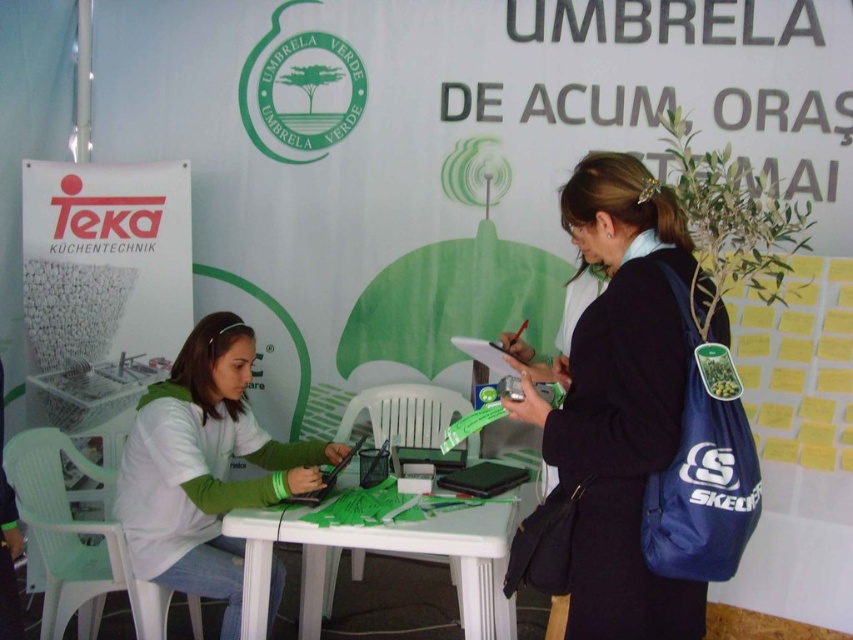
Question: Estimate the real-world distances between objects in this image. Which object is closer to the matte black laptop at center?

Choices:
 (A) white plastic table at center
 (B) green matte shirt at center
 (C) blue fabric bag at center

Answer: (A)

Question: Which is farther from the matte black laptop at center?

Choices:
 (A) green matte shirt at center
 (B) white plastic table at center
 (C) blue fabric bag at center

Answer: (C)

Question: Does blue fabric bag at center come in front of white plastic table at center?

Choices:
 (A) no
 (B) yes

Answer: (B)

Question: Is green matte shirt at center positioned behind white plastic table at center?

Choices:
 (A) yes
 (B) no

Answer: (A)

Question: Can you confirm if green matte shirt at center is positioned to the right of white plastic table at center?

Choices:
 (A) no
 (B) yes

Answer: (A)

Question: Based on their relative distances, which object is nearer to the matte black laptop at center?

Choices:
 (A) white plastic table at center
 (B) green matte shirt at center
 (C) blue fabric bag at center

Answer: (A)